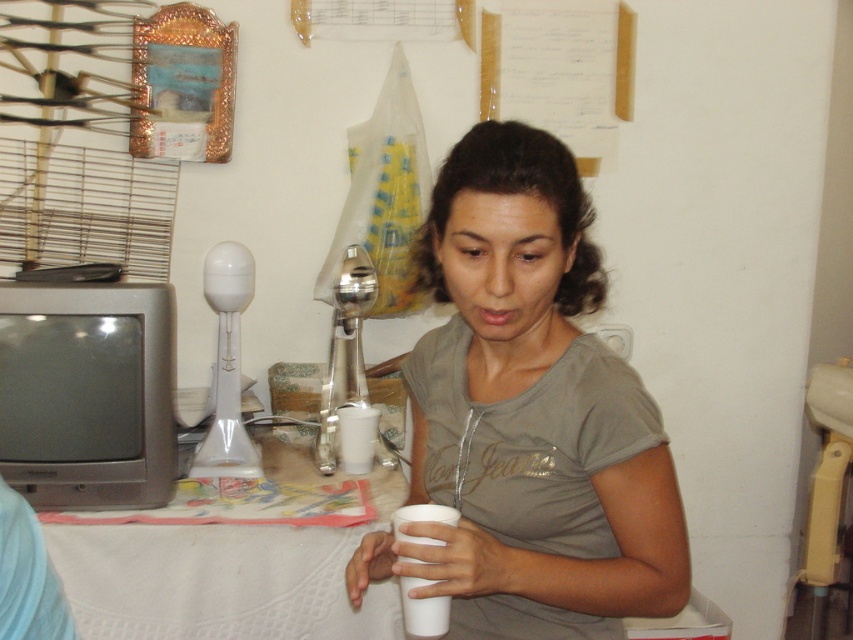
From the picture: You are standing at the camera position and want to place a 3 feet wide object on the white cloth table at lower left. Can you fit it without moving anything else?

The distance between the white cloth table at lower left and the camera is 5.13 feet. Since the object is 3 feet wide, it can fit on the table as long as there is enough space. However, the description does not provide the table dimensions, so we cannot confirm if it will fit based on the given information.

You are standing in the room and want to reach the point at coordinates (x=245, y=577). The table is between you and that point. Is the point behind the table?

The point at coordinates (x=245, y=577) is 1.60 meters from the viewer. Since the table is between you and the point, the distance indicates that the point is behind the table.

You are a photographer setting up a shot of the scene described. You want to ensure the matte gray shirt at center and the white paper cup at lower center are both in focus. Which object should you adjust your camera focus on first to ensure both are sharp?

The matte gray shirt at center is above the white paper cup at lower center. To ensure both are in focus, you should focus on the matte gray shirt at center first since it is closer to the camera, and the cup will naturally fall into the depth of field if focused on the shirt.